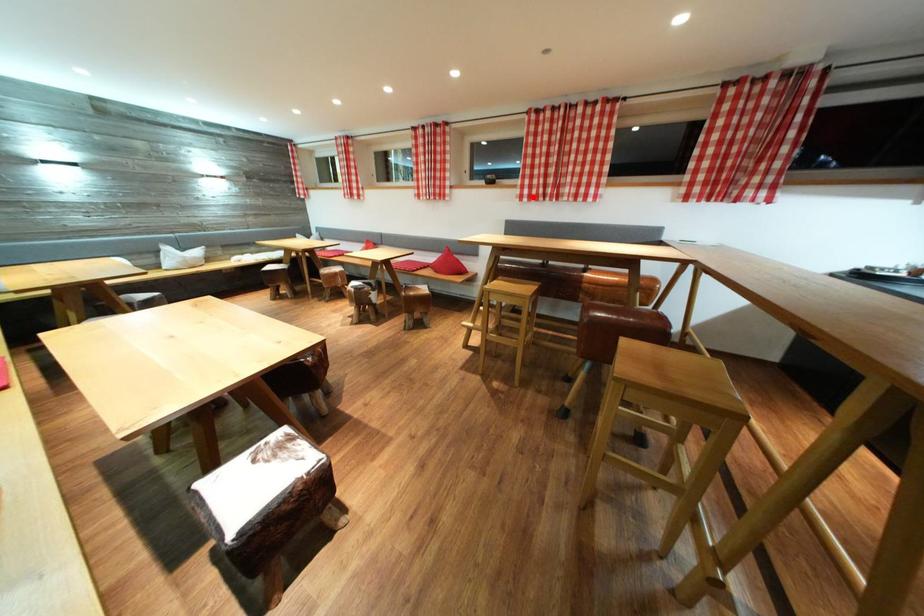
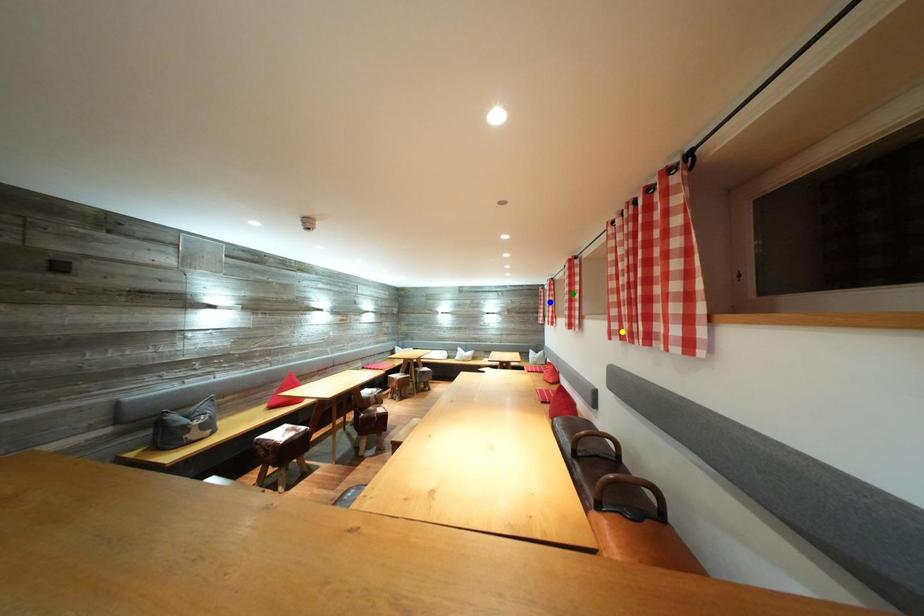
Question: I am providing you with two images of the same scene from different viewpoints. A red point is marked on the first image. You are given multiple points on the second image. Which spot in image 2 lines up with the point in image 1?

Choices:
 (A) yellow point
 (B) green point
 (C) blue point

Answer: (A)